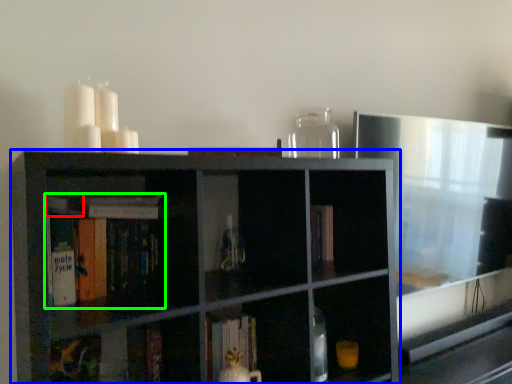
Question: Which is nearer to the book (highlighted by a red box)? shelf (highlighted by a blue box) or book (highlighted by a green box).

Choices:
 (A) shelf
 (B) book

Answer: (B)